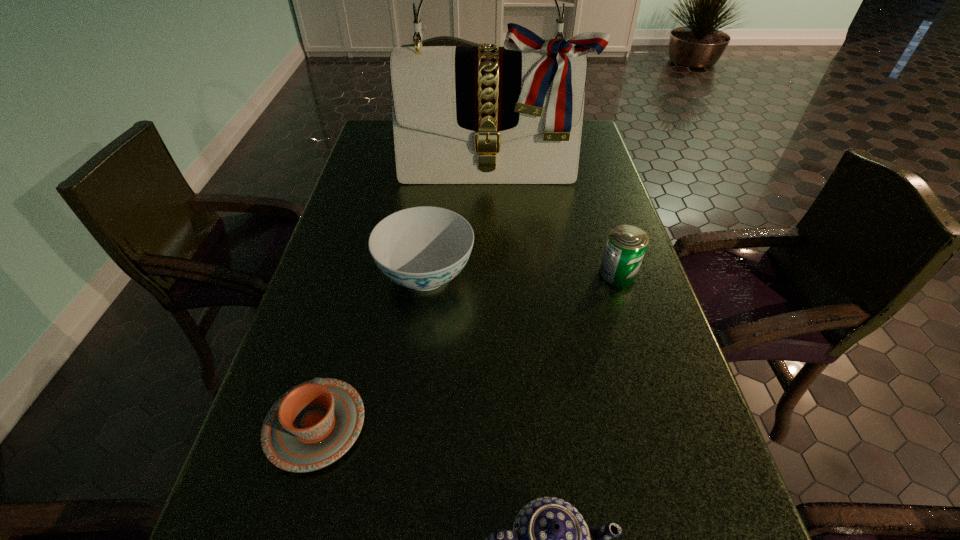
The width and height of the screenshot is (960, 540). Find the location of `free location located 0.170m on the handle side of the shortest chinaware`. free location located 0.170m on the handle side of the shortest chinaware is located at coordinates (348, 313).

The width and height of the screenshot is (960, 540). Find the location of `free space located 0.110m on the handle side of the shortest chinaware`. free space located 0.110m on the handle side of the shortest chinaware is located at coordinates (341, 335).

In order to click on object that is at the far edge in this screenshot , I will do `click(461, 115)`.

Where is `satchel at the left edge`? satchel at the left edge is located at coordinates (461, 115).

Locate an element on the screen. This screenshot has height=540, width=960. satchel at the right edge is located at coordinates (461, 115).

This screenshot has width=960, height=540. I want to click on can positioned at the right edge, so click(625, 247).

I want to click on object present at the far left corner, so click(461, 115).

I want to click on object situated at the far right corner, so click(x=461, y=115).

Image resolution: width=960 pixels, height=540 pixels. In the image, there is a desktop. What are the coordinates of `vacant space at the left edge` in the screenshot? It's located at (396, 202).

In the image, there is a desktop. At what (x,y) coordinates should I click in order to perform the action: click on free space at the right edge. Please return your answer as a coordinate pair (x, y). The height and width of the screenshot is (540, 960). Looking at the image, I should click on (692, 507).